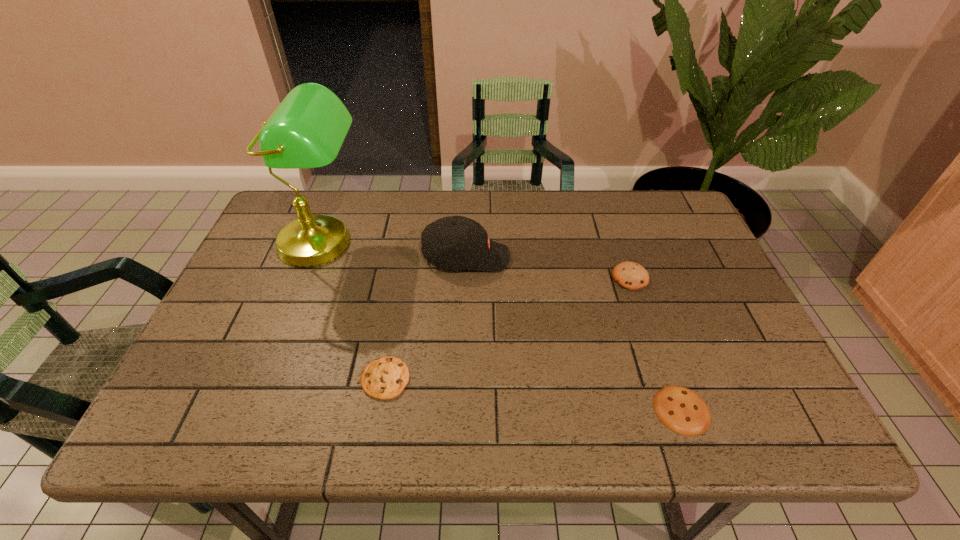
This screenshot has width=960, height=540. Find the location of `vacant space located on the left of the leftmost cookie`. vacant space located on the left of the leftmost cookie is located at coordinates (227, 379).

Locate an element on the screen. vacant region located on the back of the shortest object is located at coordinates tap(642, 299).

The height and width of the screenshot is (540, 960). In order to click on object that is at the far edge in this screenshot , I will do `click(306, 130)`.

Locate an element on the screen. object positioned at the left edge is located at coordinates (306, 130).

Where is `object that is at the far left corner`? This screenshot has height=540, width=960. object that is at the far left corner is located at coordinates (x=306, y=130).

Locate an element on the screen. free region at the far edge is located at coordinates (468, 195).

Identify the location of free region at the left edge. (274, 301).

In the image, there is a desktop. Identify the location of vacant space at the right edge. The image size is (960, 540). (687, 285).

Identify the location of free space at the near left corner of the desktop. (207, 424).

Where is `free spot between the tallest cookie and the leftmost cookie`? The width and height of the screenshot is (960, 540). free spot between the tallest cookie and the leftmost cookie is located at coordinates (508, 328).